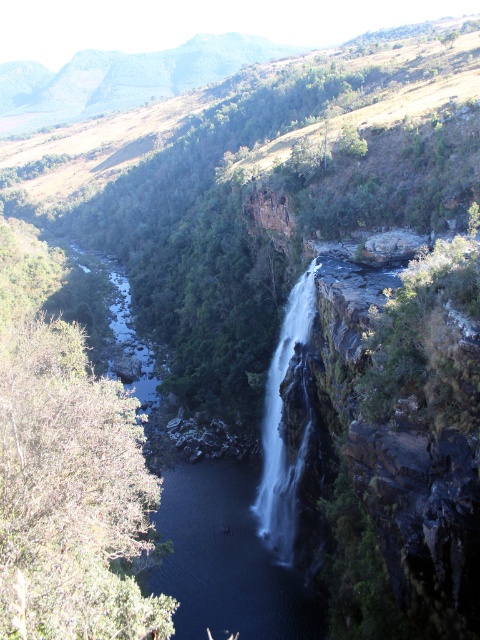
You are standing at the edge of the cliff overlooking the scene. You see the clear water at center and the white smooth waterfall at center. Which one is located to the left of the other?

The clear water at center is positioned on the left side of white smooth waterfall at center.